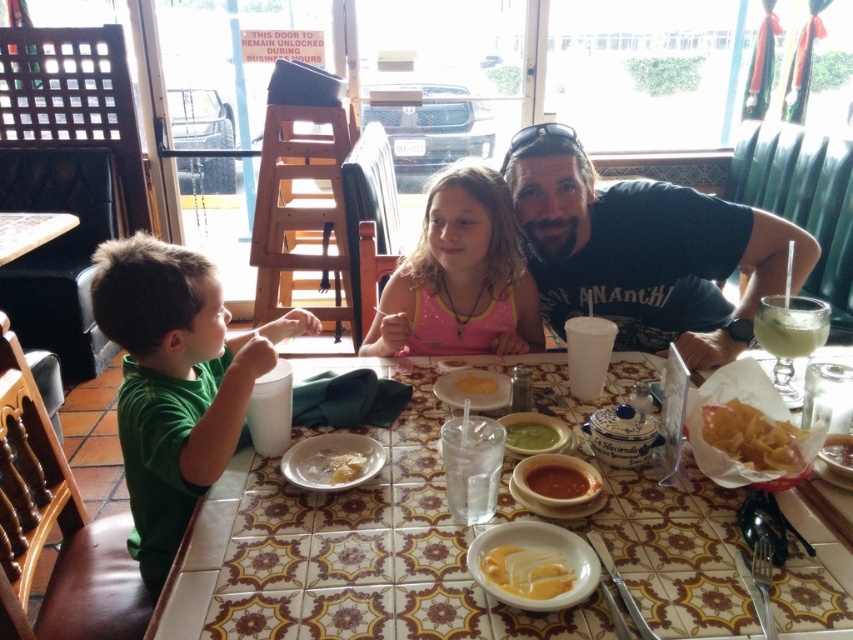
Question: Based on their relative distances, which object is farther from the golden crispy chips at lower right?

Choices:
 (A) smooth tomato sauce at center
 (B) white creamy soup at center
 (C) yellow matte tortilla at center

Answer: (B)

Question: Is the position of black t-shirt at upper right more distant than that of white creamy soup at center?

Choices:
 (A) yes
 (B) no

Answer: (A)

Question: Can you confirm if pink fabric shirt at center is wider than yellow creamy sauce at center?

Choices:
 (A) yes
 (B) no

Answer: (A)

Question: Which object is farther from the camera taking this photo?

Choices:
 (A) black t-shirt at upper right
 (B) white creamy soup at center
 (C) white ceramic plate at lower left

Answer: (A)

Question: Can you confirm if white creamy soup at center is thinner than green smoothie at center?

Choices:
 (A) yes
 (B) no

Answer: (A)

Question: Which of these objects is positioned farthest from the black t-shirt at upper right?

Choices:
 (A) yellow creamy sauce at center
 (B) white creamy soup at center

Answer: (A)